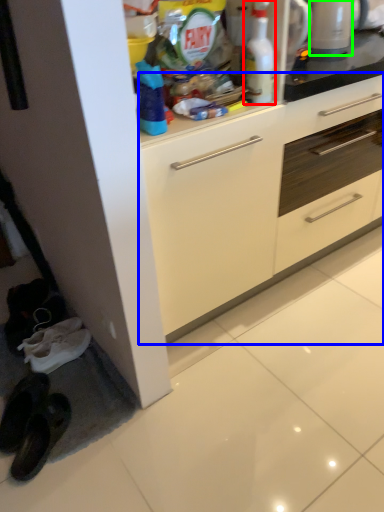
Question: Which is nearer to the cleaning product (highlighted by a red box)? cabinetry (highlighted by a blue box) or appliance (highlighted by a green box).

Choices:
 (A) cabinetry
 (B) appliance

Answer: (B)